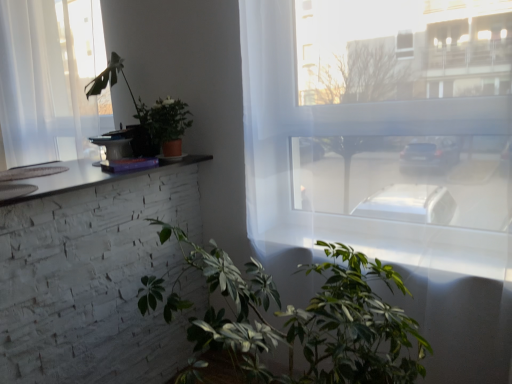
Describe the element at coordinates (148, 115) in the screenshot. The width and height of the screenshot is (512, 384). I see `green matte plant at upper left, which is the 1th houseplant from top to bottom` at that location.

Describe the element at coordinates (165, 123) in the screenshot. The image size is (512, 384). I see `matte brown pot at upper center, the second houseplant when ordered from top to bottom` at that location.

What do you see at coordinates (390, 158) in the screenshot?
I see `transparent glass window at center, which appears as the second window when viewed from the back` at bounding box center [390, 158].

In order to click on green matte plant at upper left, which is counted as the 3th houseplant, starting from the bottom in this screenshot , I will do `click(148, 115)`.

Consider the image. Is green matte plant at lower center, positioned as the first houseplant in bottom-to-top order, not close to clear glass window at upper left, which is the second window in front-to-back order?

Yes, green matte plant at lower center, positioned as the first houseplant in bottom-to-top order, is far from clear glass window at upper left, which is the second window in front-to-back order.

Image resolution: width=512 pixels, height=384 pixels. I want to click on window that is the 2nd object above the green matte plant at lower center, positioned as the third houseplant in top-to-bottom order (from a real-world perspective), so click(x=51, y=80).

In the scene shown: Between green matte plant at lower center, positioned as the third houseplant in top-to-bottom order, and clear glass window at upper left, which is the second window in front-to-back order, which one is positioned in front?

green matte plant at lower center, positioned as the third houseplant in top-to-bottom order, is more forward.

Does transparent glass window at center, the first window from the front, have a lesser height compared to green matte plant at lower center, positioned as the third houseplant in top-to-bottom order?

No.

Is transparent glass window at center, the first window from the front, bigger or smaller than green matte plant at lower center, positioned as the first houseplant in bottom-to-top order?

transparent glass window at center, the first window from the front, is smaller than green matte plant at lower center, positioned as the first houseplant in bottom-to-top order.

How far apart are transparent glass window at center, arranged as the 2th window when viewed from the left, and green matte plant at lower center, positioned as the third houseplant in top-to-bottom order?

transparent glass window at center, arranged as the 2th window when viewed from the left, and green matte plant at lower center, positioned as the third houseplant in top-to-bottom order, are 38.64 centimeters apart.

Which is more to the right, transparent glass window at center, arranged as the 2th window when viewed from the left, or green matte plant at lower center, positioned as the third houseplant in top-to-bottom order?

From the viewer's perspective, transparent glass window at center, arranged as the 2th window when viewed from the left, appears more on the right side.

Which of these two, green matte plant at upper left, which is counted as the 3th houseplant, starting from the bottom, or green matte plant at lower center, positioned as the third houseplant in top-to-bottom order, stands taller?

green matte plant at lower center, positioned as the third houseplant in top-to-bottom order, is taller.

Which is farther, (154, 131) or (149, 312)?

Positioned behind is point (154, 131).

Considering the relative positions of green matte plant at upper left, which is the 1th houseplant from top to bottom, and green matte plant at lower center, positioned as the first houseplant in bottom-to-top order, in the image provided, is green matte plant at upper left, which is the 1th houseplant from top to bottom, to the left or to the right of green matte plant at lower center, positioned as the first houseplant in bottom-to-top order,?

Based on their positions, green matte plant at upper left, which is the 1th houseplant from top to bottom, is located to the left of green matte plant at lower center, positioned as the first houseplant in bottom-to-top order.

Where is `the 2nd houseplant directly beneath the green matte plant at upper left, which is counted as the 3th houseplant, starting from the bottom (from a real-world perspective)`? The width and height of the screenshot is (512, 384). the 2nd houseplant directly beneath the green matte plant at upper left, which is counted as the 3th houseplant, starting from the bottom (from a real-world perspective) is located at coordinates (305, 318).

Is clear glass window at upper left, the second window from the right, touching green matte plant at upper left, which is counted as the 3th houseplant, starting from the bottom?

No, clear glass window at upper left, the second window from the right, is not in contact with green matte plant at upper left, which is counted as the 3th houseplant, starting from the bottom.

Considering the relative positions of clear glass window at upper left, positioned as the 1th window in left-to-right order, and green matte plant at upper left, which is the 1th houseplant from top to bottom, in the image provided, is clear glass window at upper left, positioned as the 1th window in left-to-right order, to the left of green matte plant at upper left, which is the 1th houseplant from top to bottom, from the viewer's perspective?

Yes.

Considering the points (92, 61) and (150, 129), which point is behind, point (92, 61) or point (150, 129)?

Point (92, 61)

Can you tell me how much clear glass window at upper left, positioned as the 1th window in left-to-right order, and green matte plant at upper left, which is the 1th houseplant from top to bottom, differ in facing direction?

The angle between the facing direction of clear glass window at upper left, positioned as the 1th window in left-to-right order, and the facing direction of green matte plant at upper left, which is the 1th houseplant from top to bottom, is 90 degrees.

Between point (277, 245) and point (14, 73), which one is positioned in front?

Positioned in front is point (277, 245).

Is clear glass window at upper left, the second window from the right, at the back of transparent glass window at center, acting as the first window starting from the right?

transparent glass window at center, acting as the first window starting from the right, is not turned away from clear glass window at upper left, the second window from the right.

Which of these two, transparent glass window at center, the first window from the front, or clear glass window at upper left, positioned as the 1th window in left-to-right order, is wider?

With larger width is clear glass window at upper left, positioned as the 1th window in left-to-right order.

Would you say transparent glass window at center, the first window from the front, is to the left or to the right of clear glass window at upper left, positioned as the 1th window in left-to-right order, in the picture?

From the image, it's evident that transparent glass window at center, the first window from the front, is to the right of clear glass window at upper left, positioned as the 1th window in left-to-right order.

Is point (147, 106) in front of point (418, 282)?

That is False.

Which object is closer to the camera taking this photo, matte brown pot at upper center, the second houseplant when ordered from top to bottom, or transparent glass window at center, arranged as the 2th window when viewed from the left?

transparent glass window at center, arranged as the 2th window when viewed from the left, is in front.

Is matte brown pot at upper center, the second houseplant when ordered from top to bottom, not within transparent glass window at center, arranged as the 2th window when viewed from the left?

Yes.

Consider the image. Considering the sizes of objects matte brown pot at upper center, the 2th houseplant in the bottom-to-top sequence, and transparent glass window at center, acting as the first window starting from the right, in the image provided, who is wider, matte brown pot at upper center, the 2th houseplant in the bottom-to-top sequence, or transparent glass window at center, acting as the first window starting from the right,?

With larger width is matte brown pot at upper center, the 2th houseplant in the bottom-to-top sequence.

Does point (174, 114) come closer to viewer compared to point (25, 101)?

Yes, it is in front of point (25, 101).

What's the angular difference between matte brown pot at upper center, the second houseplant when ordered from top to bottom, and clear glass window at upper left, the second window from the right,'s facing directions?

The angle between the facing direction of matte brown pot at upper center, the second houseplant when ordered from top to bottom, and the facing direction of clear glass window at upper left, the second window from the right, is 4.6e-06 degrees.

Are matte brown pot at upper center, the second houseplant when ordered from top to bottom, and clear glass window at upper left, marked as the 1th window in a back-to-front arrangement, far apart?

No, matte brown pot at upper center, the second houseplant when ordered from top to bottom, is in close proximity to clear glass window at upper left, marked as the 1th window in a back-to-front arrangement.

Is matte brown pot at upper center, the 2th houseplant in the bottom-to-top sequence, not within clear glass window at upper left, marked as the 1th window in a back-to-front arrangement?

Yes, matte brown pot at upper center, the 2th houseplant in the bottom-to-top sequence, is located beyond the bounds of clear glass window at upper left, marked as the 1th window in a back-to-front arrangement.

At what (x,y) coordinates should I click in order to perform the action: click on houseplant that is the 3rd object located in front of the clear glass window at upper left, which is the second window in front-to-back order. Please return your answer as a coordinate pair (x, y). Looking at the image, I should click on (305, 318).

Find the location of a particular element. the 1st window behind the green matte plant at lower center, positioned as the third houseplant in top-to-bottom order is located at coordinates (390, 158).

Estimate the real-world distances between objects in this image. Which object is further from matte brown pot at upper center, the 2th houseplant in the bottom-to-top sequence, green matte plant at lower center, positioned as the third houseplant in top-to-bottom order, or green matte plant at upper left, which is the 1th houseplant from top to bottom?

green matte plant at lower center, positioned as the third houseplant in top-to-bottom order, is further to matte brown pot at upper center, the 2th houseplant in the bottom-to-top sequence.

Based on their spatial positions, is matte brown pot at upper center, the second houseplant when ordered from top to bottom, or transparent glass window at center, acting as the first window starting from the right, closer to green matte plant at lower center, positioned as the third houseplant in top-to-bottom order?

Among the two, transparent glass window at center, acting as the first window starting from the right, is located nearer to green matte plant at lower center, positioned as the third houseplant in top-to-bottom order.

Based on the photo, which object lies further to the anchor point green matte plant at lower center, positioned as the first houseplant in bottom-to-top order, transparent glass window at center, the first window from the front, or green matte plant at upper left, which is the 1th houseplant from top to bottom?

The object further to green matte plant at lower center, positioned as the first houseplant in bottom-to-top order, is green matte plant at upper left, which is the 1th houseplant from top to bottom.

From the image, which object appears to be nearer to clear glass window at upper left, the second window from the right, transparent glass window at center, acting as the first window starting from the right, or green matte plant at upper left, which is the 1th houseplant from top to bottom?

green matte plant at upper left, which is the 1th houseplant from top to bottom.

Considering their positions, is transparent glass window at center, arranged as the 2th window when viewed from the left, positioned further to green matte plant at lower center, positioned as the first houseplant in bottom-to-top order, than matte brown pot at upper center, the 2th houseplant in the bottom-to-top sequence?

matte brown pot at upper center, the 2th houseplant in the bottom-to-top sequence.

Consider the image. Based on their spatial positions, is clear glass window at upper left, the second window from the right, or green matte plant at lower center, positioned as the first houseplant in bottom-to-top order, closer to transparent glass window at center, the first window from the front?

The object closer to transparent glass window at center, the first window from the front, is green matte plant at lower center, positioned as the first houseplant in bottom-to-top order.

From the image, which object appears to be nearer to green matte plant at lower center, positioned as the third houseplant in top-to-bottom order, clear glass window at upper left, the second window from the right, or matte brown pot at upper center, the second houseplant when ordered from top to bottom?

matte brown pot at upper center, the second houseplant when ordered from top to bottom, is positioned closer to the anchor green matte plant at lower center, positioned as the third houseplant in top-to-bottom order.

From the image, which object appears to be nearer to green matte plant at upper left, which is counted as the 3th houseplant, starting from the bottom, clear glass window at upper left, marked as the 1th window in a back-to-front arrangement, or green matte plant at lower center, positioned as the third houseplant in top-to-bottom order?

Based on the image, clear glass window at upper left, marked as the 1th window in a back-to-front arrangement, appears to be nearer to green matte plant at upper left, which is counted as the 3th houseplant, starting from the bottom.

Image resolution: width=512 pixels, height=384 pixels. In order to click on window between green matte plant at lower center, positioned as the third houseplant in top-to-bottom order, and green matte plant at upper left, which is the 1th houseplant from top to bottom, from front to back in this screenshot , I will do `click(390, 158)`.

The image size is (512, 384). What are the coordinates of `houseplant between clear glass window at upper left, the second window from the right, and matte brown pot at upper center, the 2th houseplant in the bottom-to-top sequence, from left to right` in the screenshot? It's located at (148, 115).

The height and width of the screenshot is (384, 512). I want to click on houseplant between green matte plant at lower center, positioned as the first houseplant in bottom-to-top order, and green matte plant at upper left, which is the 1th houseplant from top to bottom, along the z-axis, so click(x=165, y=123).

Identify the location of window located between green matte plant at lower center, positioned as the third houseplant in top-to-bottom order, and matte brown pot at upper center, the 2th houseplant in the bottom-to-top sequence, in the depth direction. This screenshot has height=384, width=512. (390, 158).